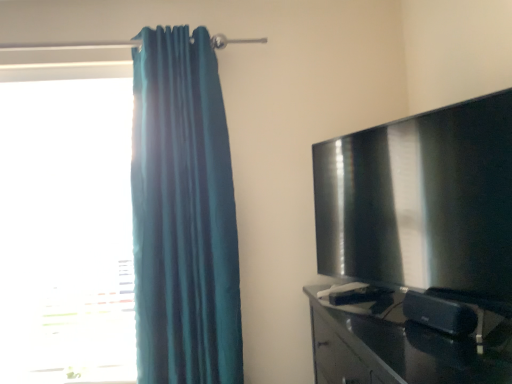
Question: From the image's perspective, is teal fabric curtain at left under matte black tv at right?

Choices:
 (A) yes
 (B) no

Answer: (B)

Question: Is teal fabric curtain at left further to camera compared to matte black tv at right?

Choices:
 (A) no
 (B) yes

Answer: (B)

Question: From the image's perspective, is teal fabric curtain at left over matte black tv at right?

Choices:
 (A) yes
 (B) no

Answer: (A)

Question: Is there a large distance between teal fabric curtain at left and matte black tv at right?

Choices:
 (A) no
 (B) yes

Answer: (A)

Question: Can you confirm if teal fabric curtain at left is positioned to the right of matte black tv at right?

Choices:
 (A) no
 (B) yes

Answer: (A)

Question: Considering the relative sizes of teal fabric curtain at left and matte black tv at right in the image provided, is teal fabric curtain at left bigger than matte black tv at right?

Choices:
 (A) yes
 (B) no

Answer: (A)

Question: From the image's perspective, is matte black tv at right under glossy black tv stand at right?

Choices:
 (A) yes
 (B) no

Answer: (B)

Question: From a real-world perspective, is matte black tv at right under glossy black tv stand at right?

Choices:
 (A) yes
 (B) no

Answer: (B)

Question: Considering the relative sizes of matte black tv at right and glossy black tv stand at right in the image provided, is matte black tv at right taller than glossy black tv stand at right?

Choices:
 (A) yes
 (B) no

Answer: (A)

Question: Is matte black tv at right wider than glossy black tv stand at right?

Choices:
 (A) no
 (B) yes

Answer: (A)

Question: Is matte black tv at right looking in the opposite direction of glossy black tv stand at right?

Choices:
 (A) yes
 (B) no

Answer: (B)

Question: From a real-world perspective, does matte black tv at right stand above glossy black tv stand at right?

Choices:
 (A) no
 (B) yes

Answer: (B)

Question: Is matte black tv at right aimed at transparent glass window at left?

Choices:
 (A) no
 (B) yes

Answer: (A)